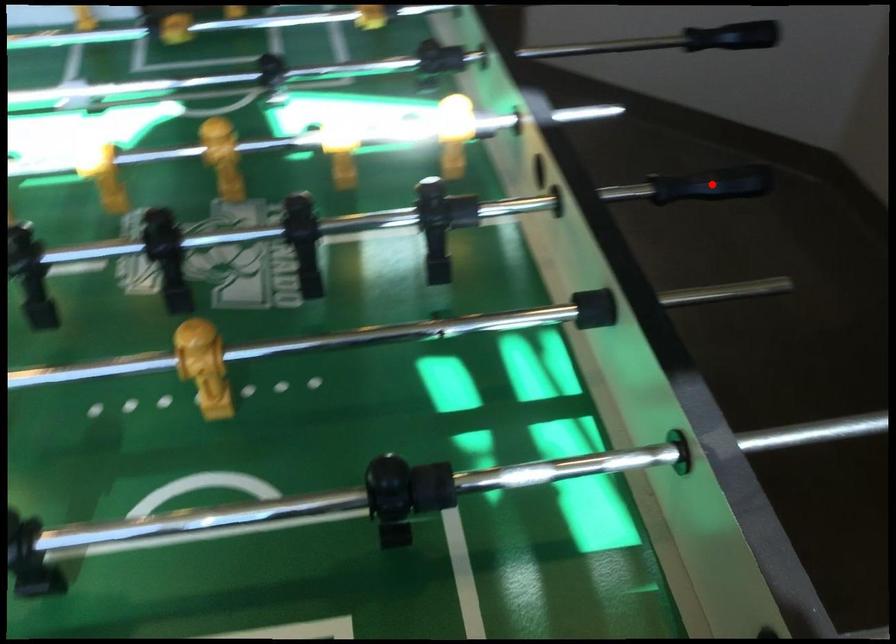
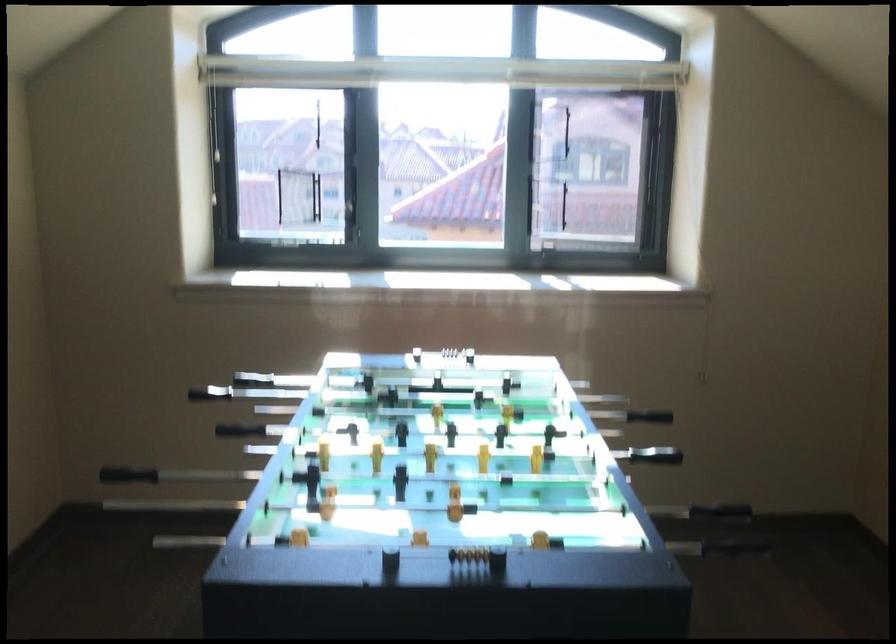
Where in the second image is the point corresponding to the highlighted location from the first image?

(219, 439)